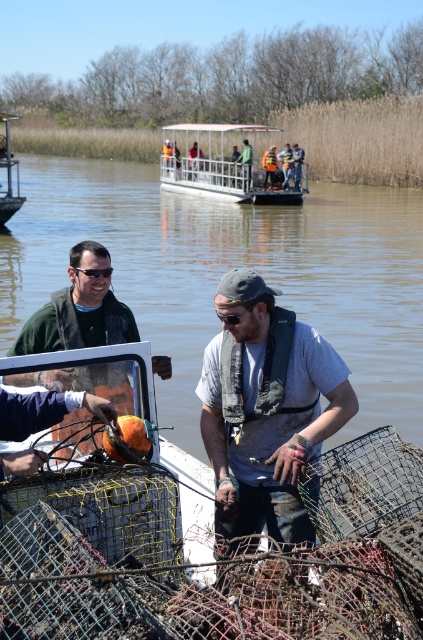
Question: Among these objects, which one is farthest from the camera?

Choices:
 (A) orange life vest at center
 (B) clear water at boat center

Answer: (A)

Question: Which object is the farthest from the metallic silver boat at center?

Choices:
 (A) clear water at boat center
 (B) white plastic boat at center
 (C) gray fabric shirt at center

Answer: (C)

Question: Does clear water at boat center have a greater width compared to white plastic boat at center?

Choices:
 (A) no
 (B) yes

Answer: (B)

Question: Which object is positioned closest to the white plastic boat at center?

Choices:
 (A) gray fabric shirt at center
 (B) clear water at boat center

Answer: (B)

Question: Is white plastic boat at center positioned behind green matte jacket at center?

Choices:
 (A) yes
 (B) no

Answer: (A)

Question: Does white plastic boat at center have a lesser width compared to green matte jacket at center?

Choices:
 (A) no
 (B) yes

Answer: (A)